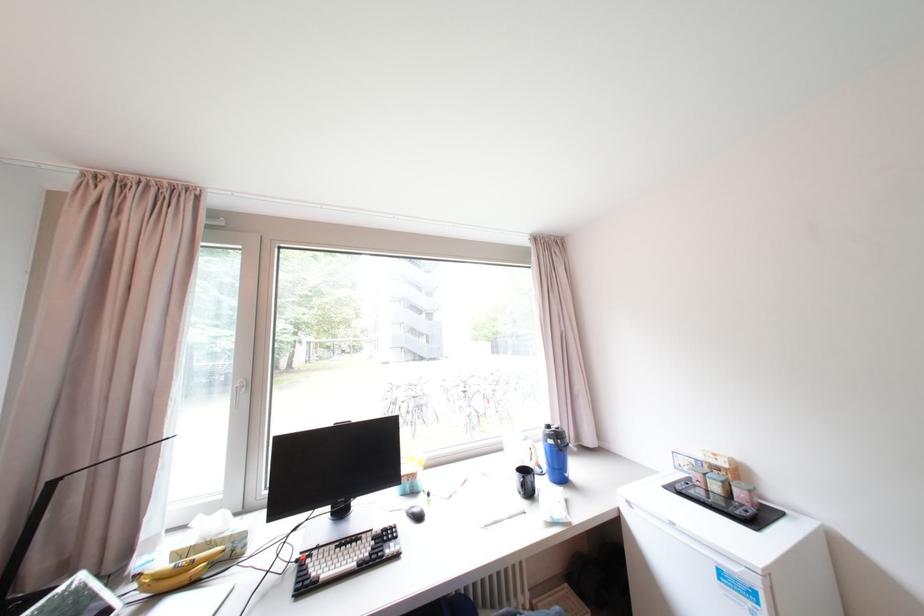
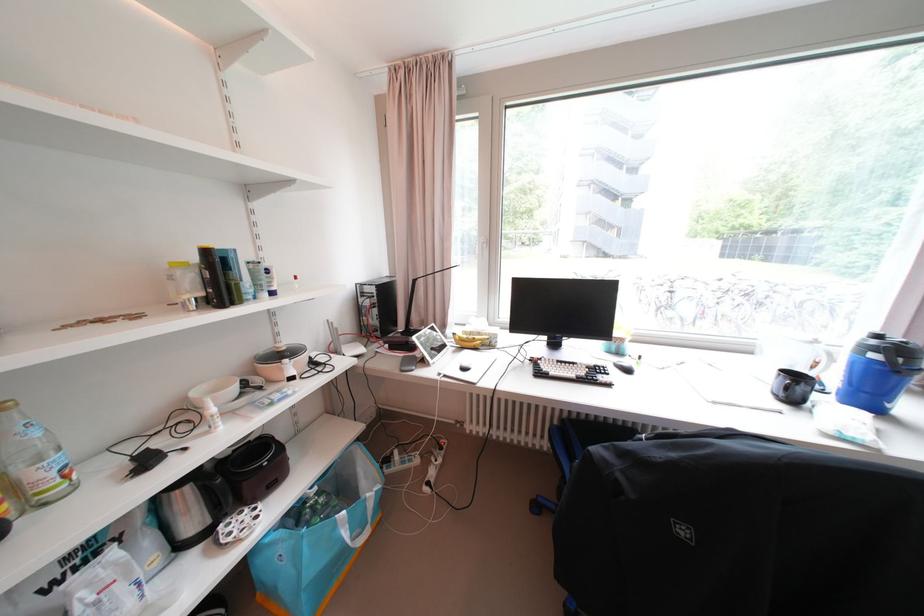
In the second image, find the point that corresponds to the point at 567,442 in the first image.

(909, 361)